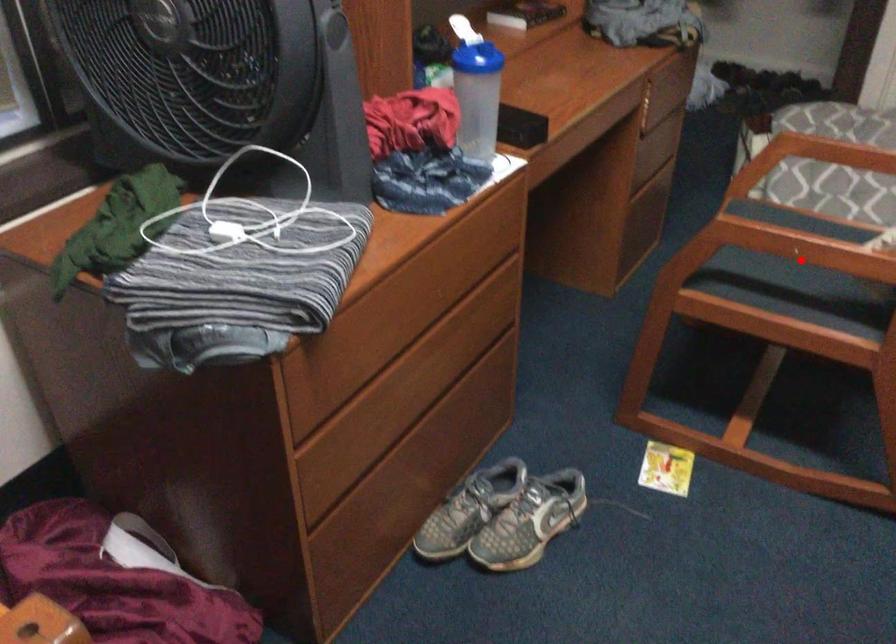
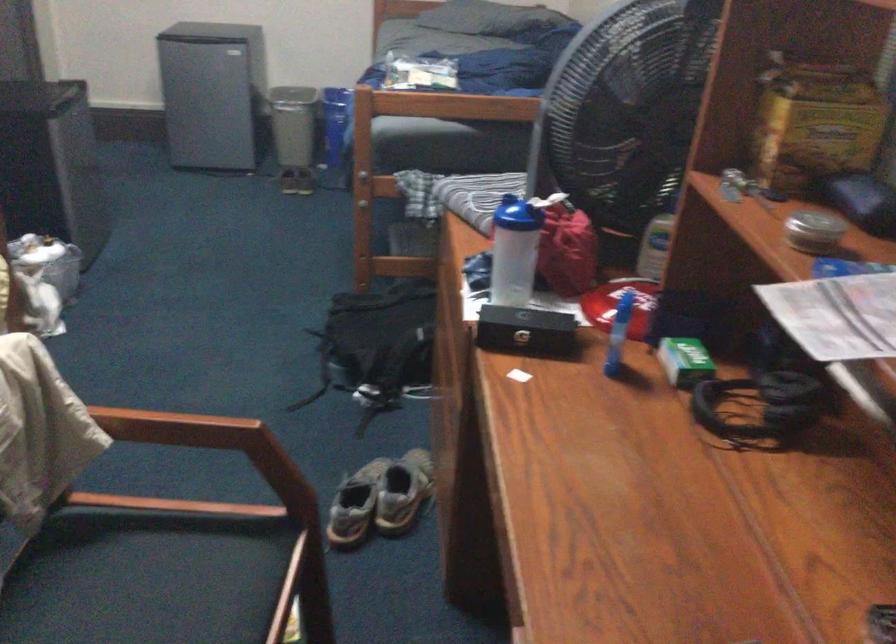
Question: I am providing you with two images of the same scene from different viewpoints. Image1 has a red point marked. In image2, the corresponding 3D location appears at what relative position? Reply with the corresponding letter.

Choices:
 (A) Closer
 (B) Farther

Answer: (A)